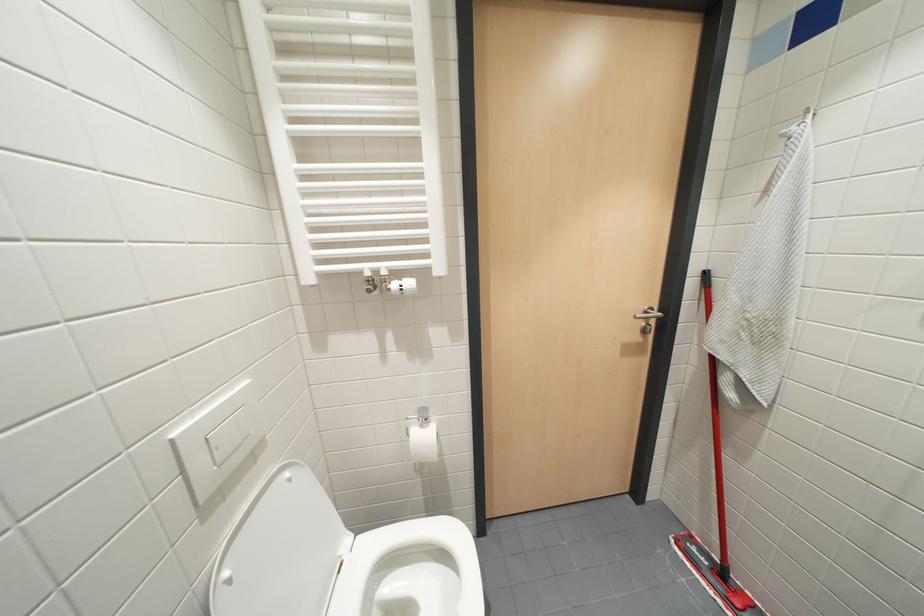
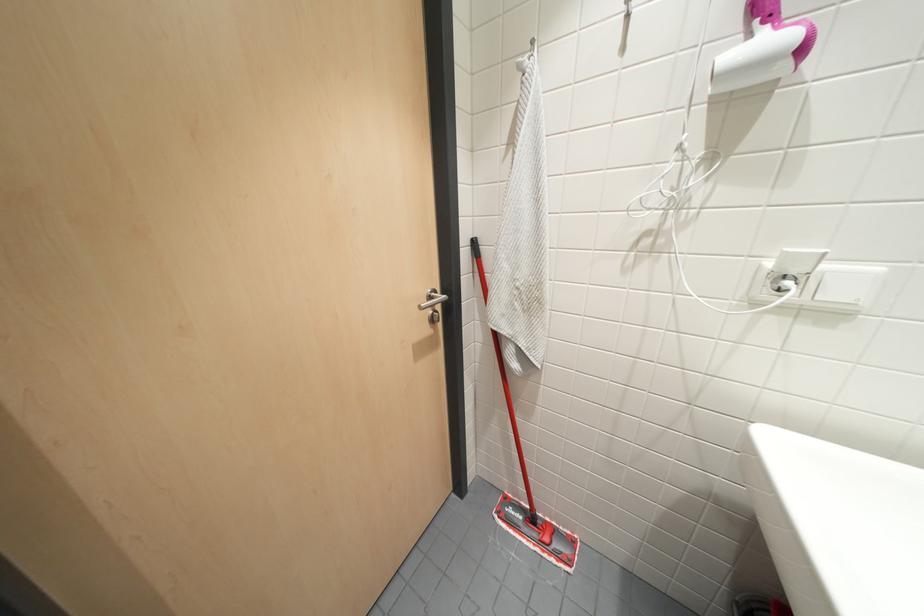
Question: How did the camera likely rotate?

Choices:
 (A) Left
 (B) Right
 (C) Up
 (D) Down

Answer: (B)